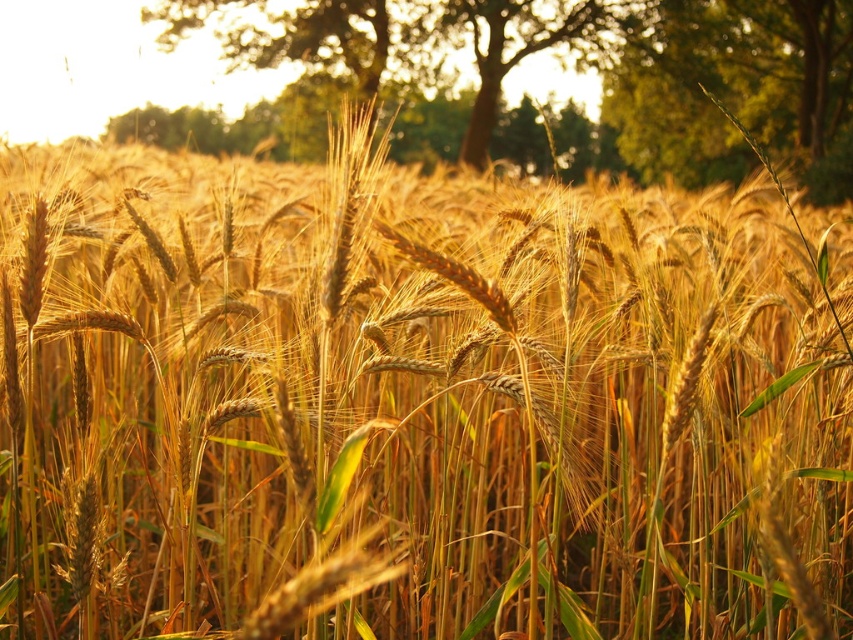
Question: Is green leafy tree at upper center above green leafy tree at upper right?

Choices:
 (A) yes
 (B) no

Answer: (B)

Question: Where is green leafy tree at upper center located in relation to green leafy tree at upper right in the image?

Choices:
 (A) left
 (B) right

Answer: (A)

Question: Which point appears closest to the camera in this image?

Choices:
 (A) (190, 1)
 (B) (741, 115)

Answer: (A)

Question: Is the position of green leafy tree at upper center less distant than that of green leafy tree at upper right?

Choices:
 (A) no
 (B) yes

Answer: (B)